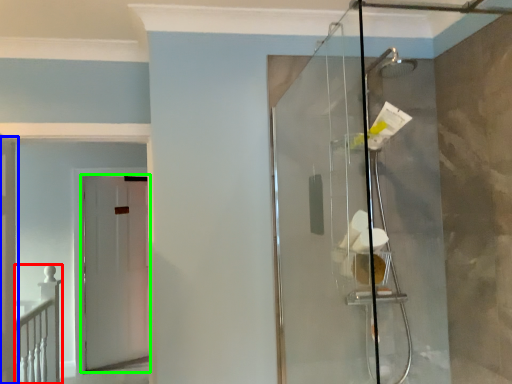
Question: Which object is the farthest from rail (highlighted by a red box)? Choose among these: door (highlighted by a blue box) or door (highlighted by a green box).

Choices:
 (A) door
 (B) door

Answer: (B)